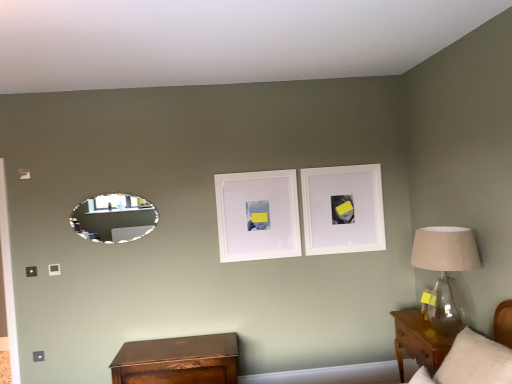
Question: Considering the positions of white matte picture frame at center, the 2th picture frame when ordered from right to left, and brown wood nightstand at lower right, which is the 1th nightstand in right-to-left order, in the image, is white matte picture frame at center, the 2th picture frame when ordered from right to left, taller or shorter than brown wood nightstand at lower right, which is the 1th nightstand in right-to-left order,?

Choices:
 (A) tall
 (B) short

Answer: (A)

Question: From a real-world perspective, is white matte picture frame at center, which is the 1th picture frame from left to right, physically located above or below brown wood nightstand at lower right, which is the 1th nightstand in right-to-left order?

Choices:
 (A) above
 (B) below

Answer: (A)

Question: Which of these objects is positioned closest to the wooden nightstand at lower left, the first nightstand from the left?

Choices:
 (A) clear glass lampshade at right
 (B) white matte picture frame at center, which is the 1th picture frame from left to right
 (C) brown wood nightstand at lower right, which is the 1th nightstand in right-to-left order
 (D) oval silver mirror at left
 (E) white matte picture frame at upper center, which is the 1th picture frame from right to left

Answer: (B)

Question: Estimate the real-world distances between objects in this image. Which object is closer to the wooden nightstand at lower left, the first nightstand from the left?

Choices:
 (A) white matte picture frame at upper center, which is the 1th picture frame from right to left
 (B) brown wood nightstand at lower right, which is the 1th nightstand in right-to-left order
 (C) clear glass lampshade at right
 (D) white matte picture frame at center, which is the 1th picture frame from left to right
 (E) oval silver mirror at left

Answer: (D)